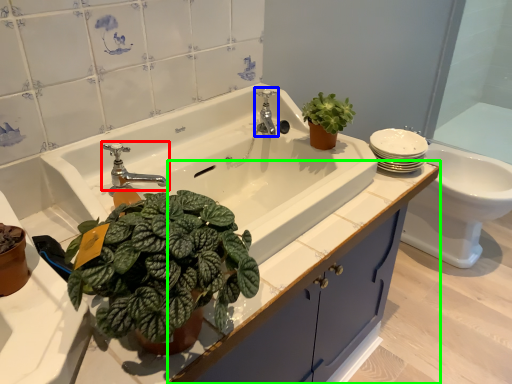
Question: Considering the real-world distances, which object is farthest from tap (highlighted by a red box)? tap (highlighted by a blue box) or bathroom cabinet (highlighted by a green box)?

Choices:
 (A) tap
 (B) bathroom cabinet

Answer: (B)